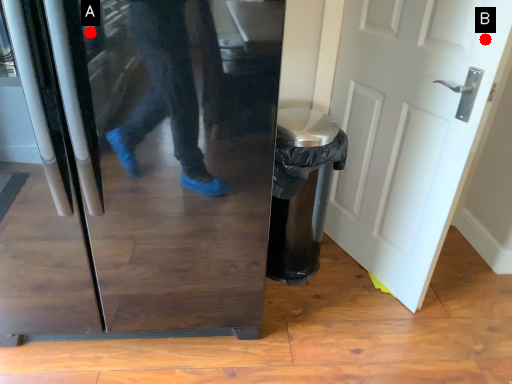
Question: Two points are circled on the image, labeled by A and B beside each circle. Which point is farther to the camera?

Choices:
 (A) A is further
 (B) B is further

Answer: (B)